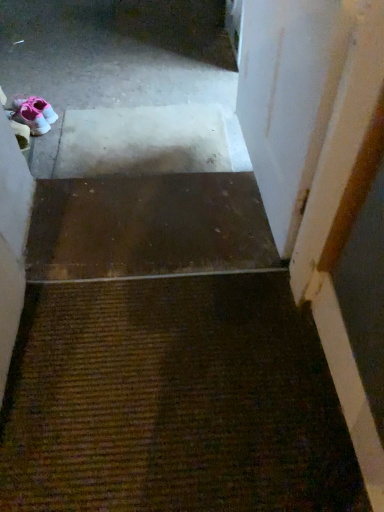
Question: Does white matte door at upper right turn towards brown matte stair at center?

Choices:
 (A) no
 (B) yes

Answer: (B)

Question: Is white matte door at upper right at the right side of brown matte stair at center?

Choices:
 (A) no
 (B) yes

Answer: (B)

Question: Is white matte door at upper right located outside brown matte stair at center?

Choices:
 (A) yes
 (B) no

Answer: (A)

Question: From a real-world perspective, is white matte door at upper right physically above brown matte stair at center?

Choices:
 (A) no
 (B) yes

Answer: (B)

Question: Is white matte door at upper right next to brown matte stair at center?

Choices:
 (A) yes
 (B) no

Answer: (B)

Question: Can you confirm if white matte door at upper right is smaller than brown matte stair at center?

Choices:
 (A) yes
 (B) no

Answer: (B)

Question: Can you confirm if brown textured mat at center is bigger than white matte door at upper right?

Choices:
 (A) yes
 (B) no

Answer: (B)

Question: Considering the relative sizes of brown textured mat at center and white matte door at upper right in the image provided, is brown textured mat at center shorter than white matte door at upper right?

Choices:
 (A) yes
 (B) no

Answer: (A)

Question: Does brown textured mat at center appear on the left side of white matte door at upper right?

Choices:
 (A) no
 (B) yes

Answer: (B)

Question: Is white matte door at upper right located within brown textured mat at center?

Choices:
 (A) no
 (B) yes

Answer: (A)

Question: Is brown textured mat at center taller than white matte door at upper right?

Choices:
 (A) yes
 (B) no

Answer: (B)

Question: Is brown textured mat at center facing towards white matte door at upper right?

Choices:
 (A) no
 (B) yes

Answer: (A)

Question: Is pink fabric sneakers at upper left oriented towards brown matte stair at center?

Choices:
 (A) no
 (B) yes

Answer: (A)